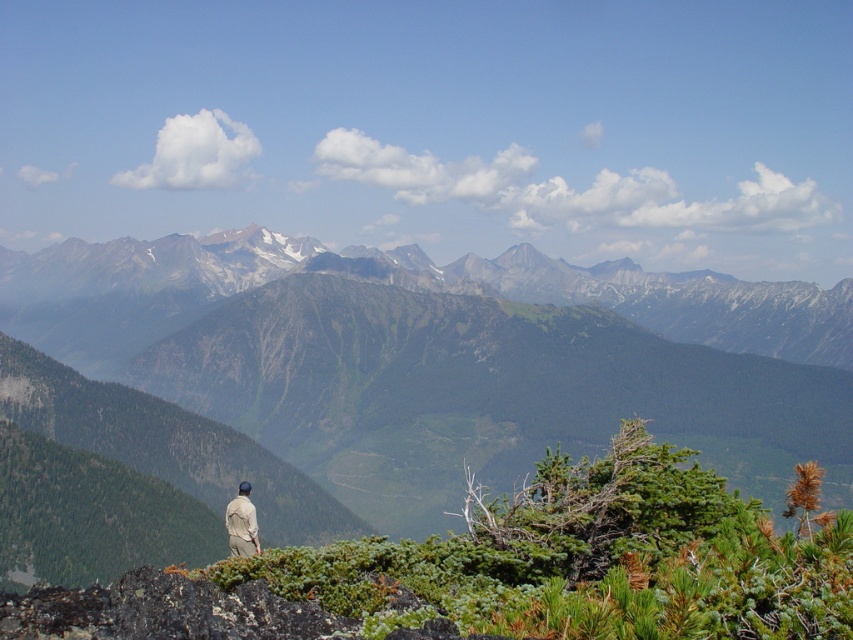
Question: Can you confirm if green rocky mountains at center is wider than tan fabric jacket at lower left?

Choices:
 (A) yes
 (B) no

Answer: (A)

Question: Which point is farther to the camera?

Choices:
 (A) (770, 291)
 (B) (389, 362)
 (C) (239, 545)

Answer: (A)

Question: Does green rocky mountains at center have a greater width compared to tan fabric jacket at lower left?

Choices:
 (A) yes
 (B) no

Answer: (A)

Question: Estimate the real-world distances between objects in this image. Which object is farther from the tan fabric jacket at lower left?

Choices:
 (A) green grassy mountain range at center
 (B) green rocky mountains at center

Answer: (B)

Question: Among these points, which one is nearest to the camera?

Choices:
 (A) (247, 492)
 (B) (618, 305)

Answer: (A)

Question: Can you confirm if green grassy mountain range at center is thinner than green rocky mountains at center?

Choices:
 (A) no
 (B) yes

Answer: (B)